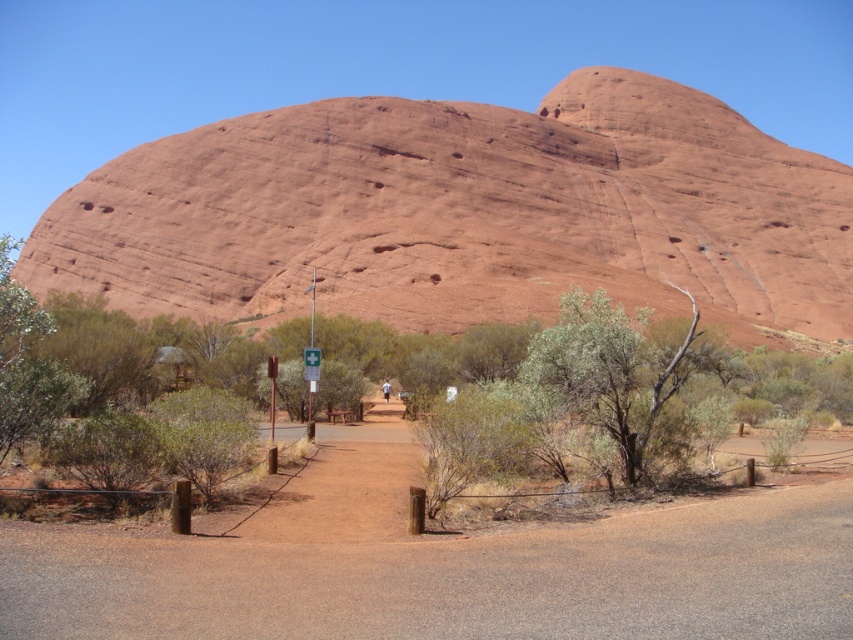
Question: From the image, what is the correct spatial relationship of brown dirt track at center in relation to green plastic sign at center?

Choices:
 (A) above
 (B) below

Answer: (B)

Question: Which point is farther to the camera?

Choices:
 (A) green leafy shrub at lower center
 (B) green leafy bush at center

Answer: (A)

Question: Which is nearer to the green leafy shrub at lower center?

Choices:
 (A) reddish-brown rock formation at upper center
 (B) green leafy bush at center
 (C) brown dirt track at center

Answer: (B)

Question: Can you confirm if green leafy bush at center is positioned to the left of green plastic sign at center?

Choices:
 (A) no
 (B) yes

Answer: (B)

Question: Which is nearer to the brown dirt track at center?

Choices:
 (A) green leafy shrub at lower center
 (B) green plastic sign at center
 (C) green leafy bush at center

Answer: (A)

Question: Does brown dirt track at center lie behind green leafy bush at center?

Choices:
 (A) yes
 (B) no

Answer: (B)